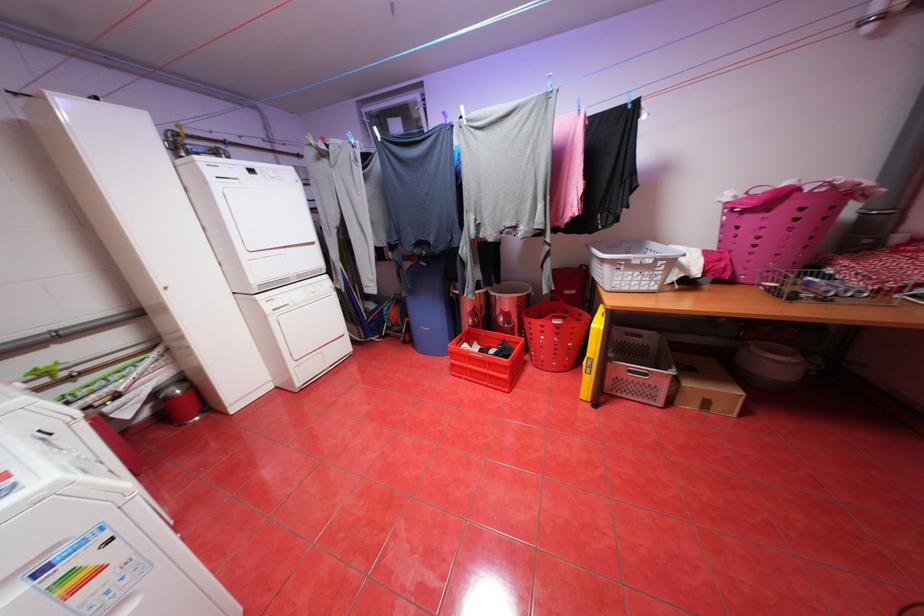
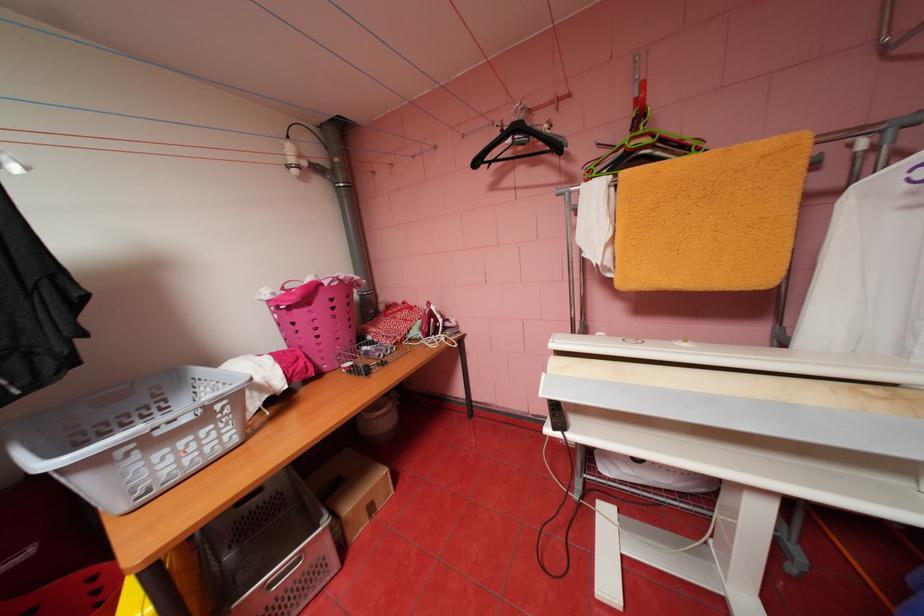
Where in the second image is the point corresponding to pixel 714 403 from the first image?

(380, 508)